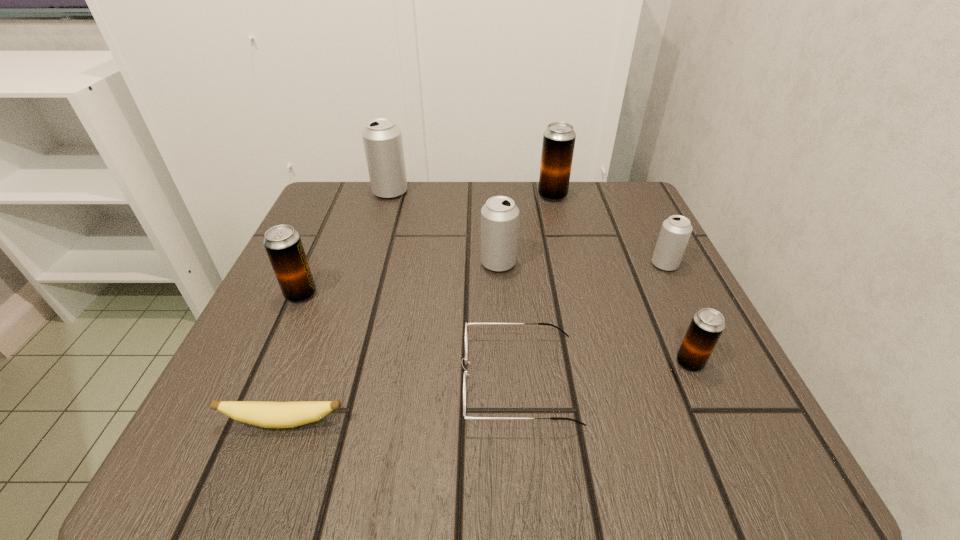
This screenshot has height=540, width=960. In order to click on the leftmost white beer can in this screenshot , I will do `click(382, 138)`.

Find the location of a particular element. Image resolution: width=960 pixels, height=540 pixels. the fifth beer can from right to left is located at coordinates pos(382,138).

This screenshot has height=540, width=960. Identify the location of the biggest black beer can. (559, 138).

Locate an element on the screen. the second black beer can from right to left is located at coordinates (559, 138).

I want to click on the second white beer can from left to right, so click(x=499, y=216).

I want to click on the second biggest white beer can, so click(499, 216).

Identify the location of the second farthest black beer can. The width and height of the screenshot is (960, 540). (283, 244).

Where is `the leftmost beer can`? the leftmost beer can is located at coordinates (283, 244).

This screenshot has width=960, height=540. Find the location of `the smallest white beer can`. the smallest white beer can is located at coordinates (675, 232).

Where is `the nearest beer can`? The width and height of the screenshot is (960, 540). the nearest beer can is located at coordinates (707, 325).